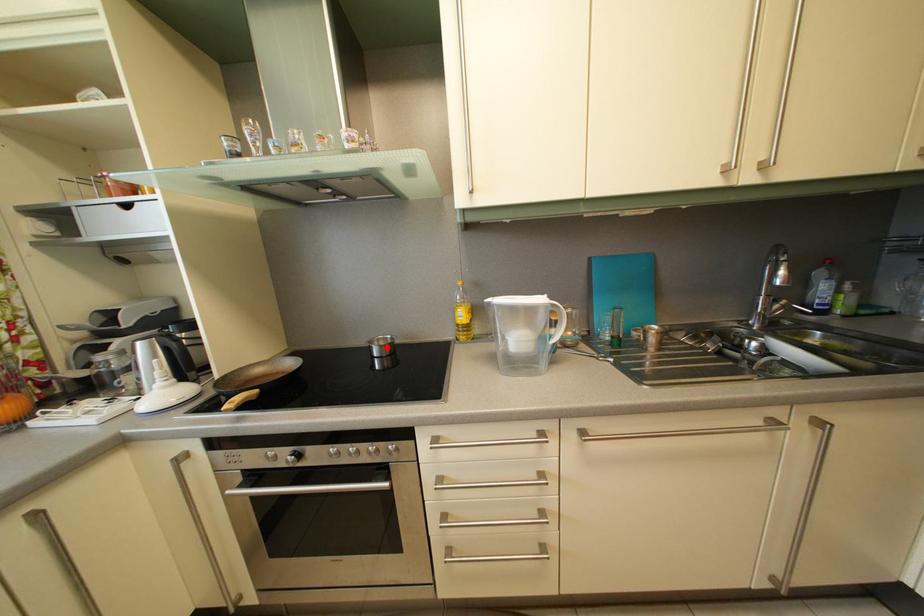
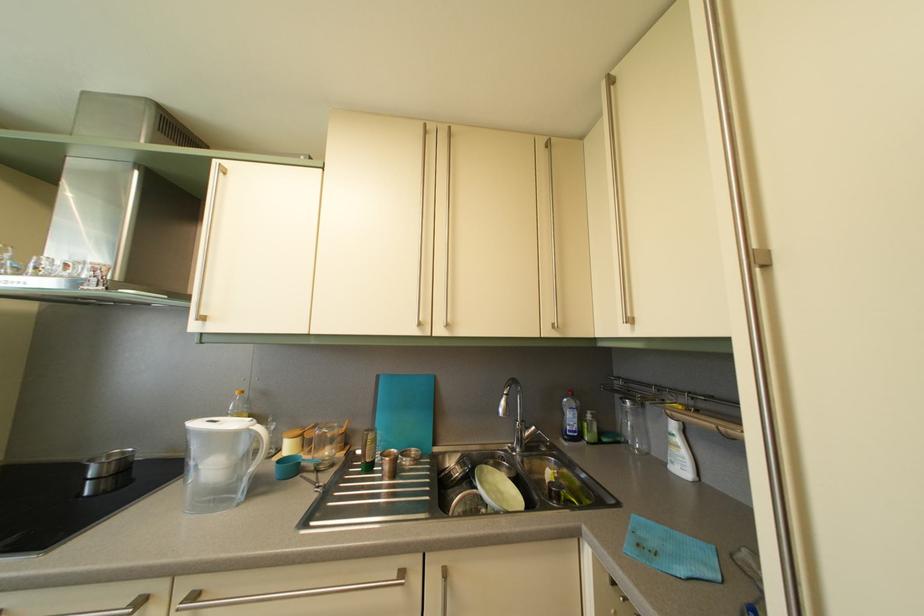
Locate, in the second image, the point that corresponds to the highlighted location in the first image.

(118, 463)